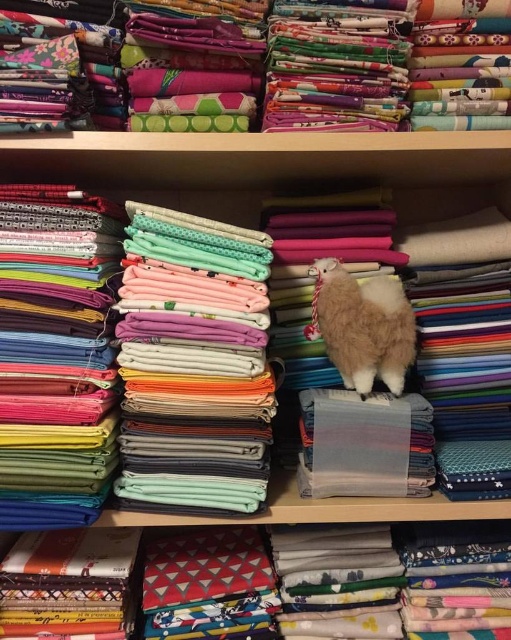
Question: Is floral fabric at upper center above matte green fabric at left?

Choices:
 (A) no
 (B) yes

Answer: (B)

Question: Which of these objects is positioned closest to the floral fabric at upper center?

Choices:
 (A) matte green fabric at left
 (B) smooth cotton fabric at center
 (C) fluffy white alpaca at center

Answer: (B)

Question: Among these points, which one is nearest to the camera?

Choices:
 (A) (390, 61)
 (B) (201, 400)

Answer: (B)

Question: Can you confirm if floral fabric at upper center is thinner than smooth cotton fabric at center?

Choices:
 (A) yes
 (B) no

Answer: (B)

Question: Can you confirm if floral fabric at upper center is bigger than smooth cotton fabric at center?

Choices:
 (A) no
 (B) yes

Answer: (B)

Question: Which point appears closest to the camera in this image?

Choices:
 (A) (217, 292)
 (B) (326, 260)

Answer: (A)